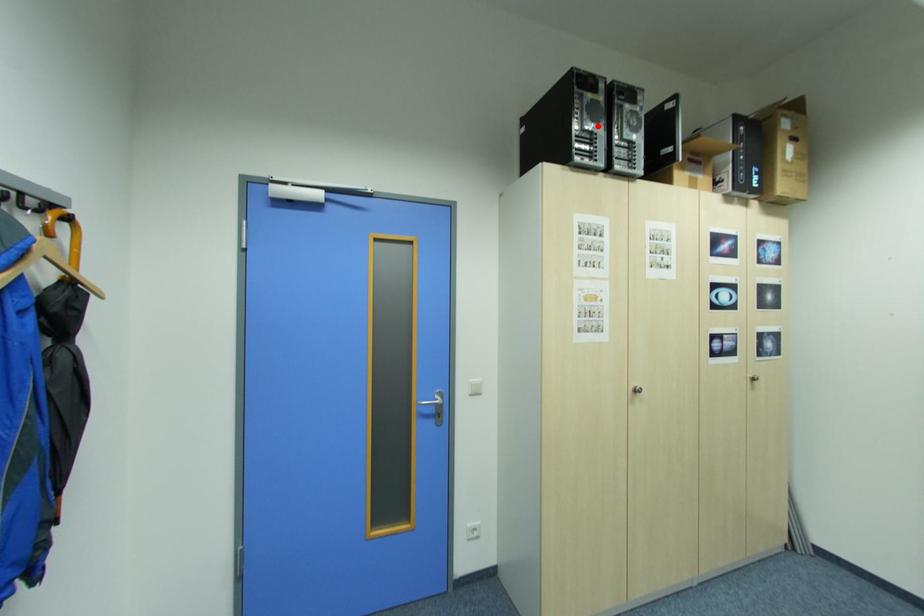
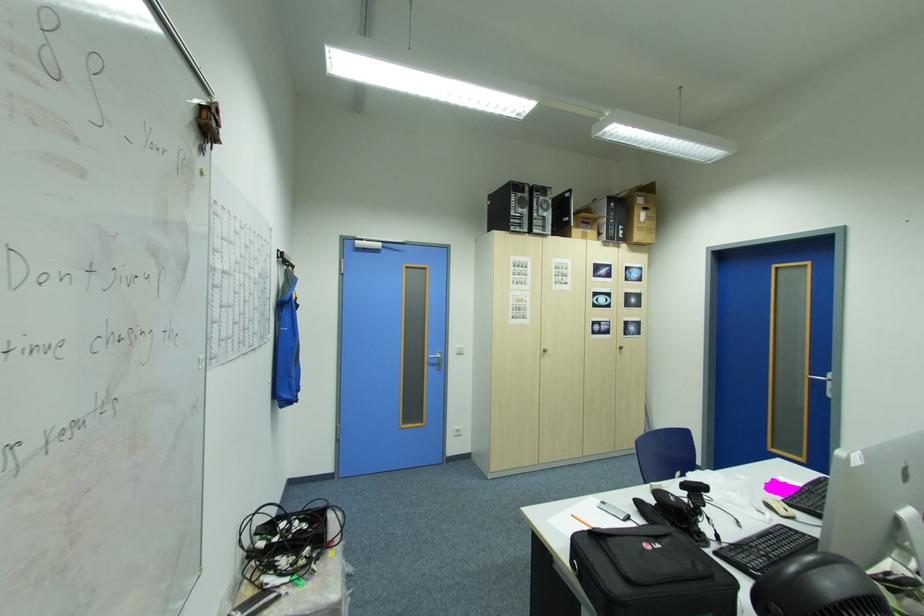
The point at the highlighted location is marked in the first image. Where is the corresponding point in the second image?

(527, 212)